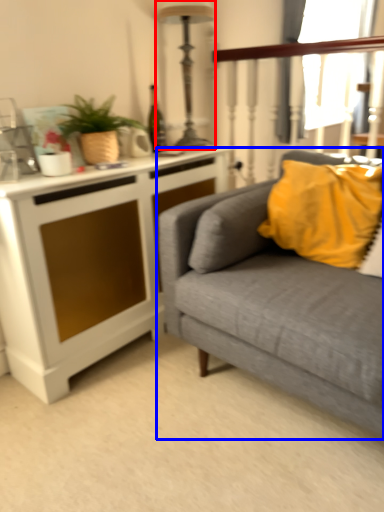
Question: Which object appears farthest to the camera in this image, lamp (highlighted by a red box) or studio couch (highlighted by a blue box)?

Choices:
 (A) lamp
 (B) studio couch

Answer: (A)